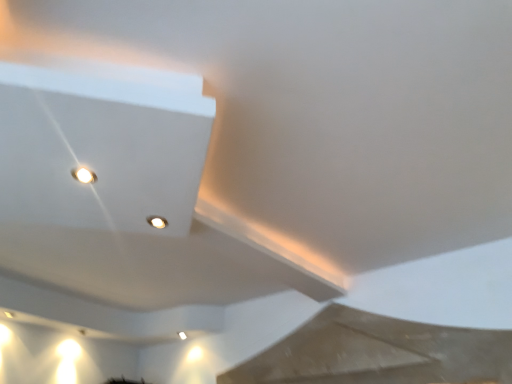
Describe the element at coordinates (157, 222) in the screenshot. This screenshot has width=512, height=384. I see `matte white droplight at center` at that location.

Where is `matte white droplight at center`? matte white droplight at center is located at coordinates (157, 222).

At what (x,y) coordinates should I click in order to perform the action: click on matte white droplight at center. Please return your answer as a coordinate pair (x, y). Looking at the image, I should click on (157, 222).